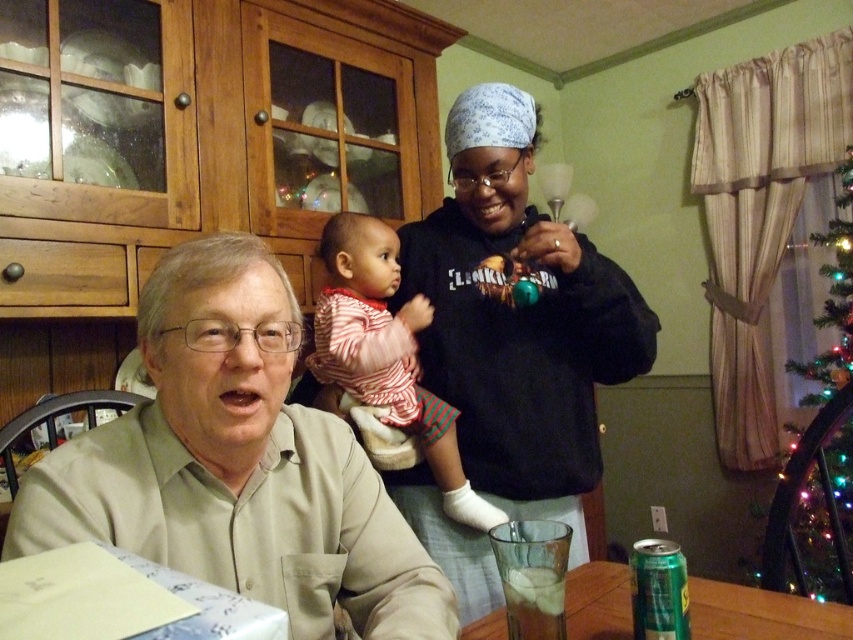
Looking at this image, which is more to the left, black matte sweatshirt at center or striped cotton onesie at center?

striped cotton onesie at center is more to the left.

Which of these two, black matte sweatshirt at center or striped cotton onesie at center, stands taller?

Standing taller between the two is black matte sweatshirt at center.

Does point (537, 500) come farther from viewer compared to point (376, 292)?

That is False.

Locate an element on the screen. The image size is (853, 640). black matte sweatshirt at center is located at coordinates (518, 317).

Between striped cotton onesie at center and iridescent glass christmas tree at right, which one is positioned lower?

iridescent glass christmas tree at right is below.

Consider the image. Is striped cotton onesie at center closer to the viewer compared to iridescent glass christmas tree at right?

Yes, it is in front of iridescent glass christmas tree at right.

Does point (444, 436) lie in front of point (773, 545)?

No, (444, 436) is further to viewer.

Where is `striped cotton onesie at center`? This screenshot has width=853, height=640. striped cotton onesie at center is located at coordinates (386, 353).

Is point (33, 481) positioned behind point (471, 288)?

That is False.

Measure the distance between light beige shirt at lower left and camera.

They are 27.69 inches apart.

At what (x,y) coordinates should I click in order to perform the action: click on light beige shirt at lower left. Please return your answer as a coordinate pair (x, y). The height and width of the screenshot is (640, 853). Looking at the image, I should click on (236, 465).